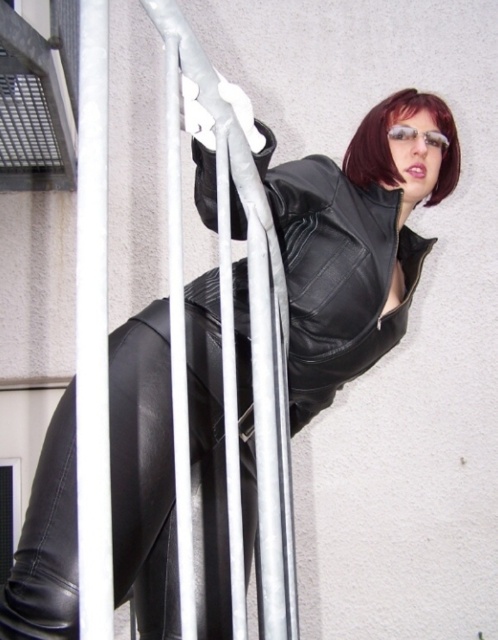
Question: Can you confirm if black leather pants at center is positioned to the right of dark red hair at upper center?

Choices:
 (A) yes
 (B) no

Answer: (B)

Question: Does black leather pants at center appear under silver metallic pole at left?

Choices:
 (A) no
 (B) yes

Answer: (B)

Question: Which object is positioned closest to the silver metallic pole at left?

Choices:
 (A) black leather jacket at center
 (B) dark red hair at upper center
 (C) black leather pants at center

Answer: (C)

Question: Based on their relative distances, which object is nearer to the silver metallic pole at left?

Choices:
 (A) dark red hair at upper center
 (B) black leather pants at center

Answer: (B)

Question: Which point appears closest to the camera in this image?

Choices:
 (A) (317, 371)
 (B) (375, 134)
 (C) (83, 454)
 (D) (202, 307)

Answer: (C)

Question: Does black leather pants at center appear under dark red hair at upper center?

Choices:
 (A) no
 (B) yes

Answer: (B)